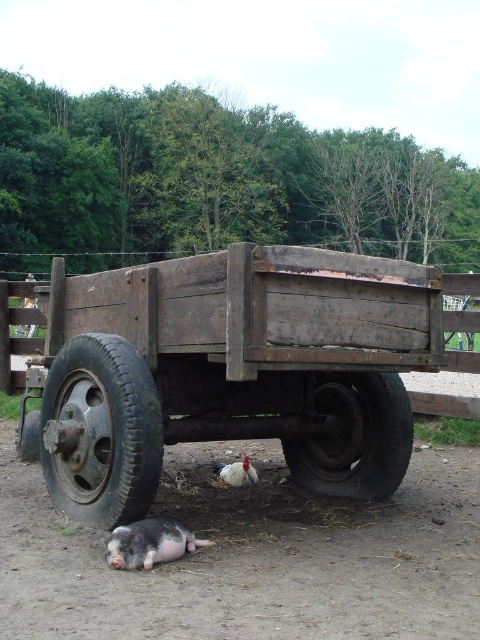
Looking at this image, you are a farmer checking the condition of your cart. You notice two black rubber tires on the ground near the cart. Which tire has a greater width when comparing the black rubber tire at lower left and the black rubber tire at lower center?

The black rubber tire at lower left has a greater width than the black rubber tire at lower center.

You are a farmer checking the condition of your cart. You notice two black rubber tires on the ground near the cart. Which tire, the black rubber tire at lower left or the black rubber tire at lower center, is taller?

The black rubber tire at lower left is much taller than the black rubber tire at lower center.